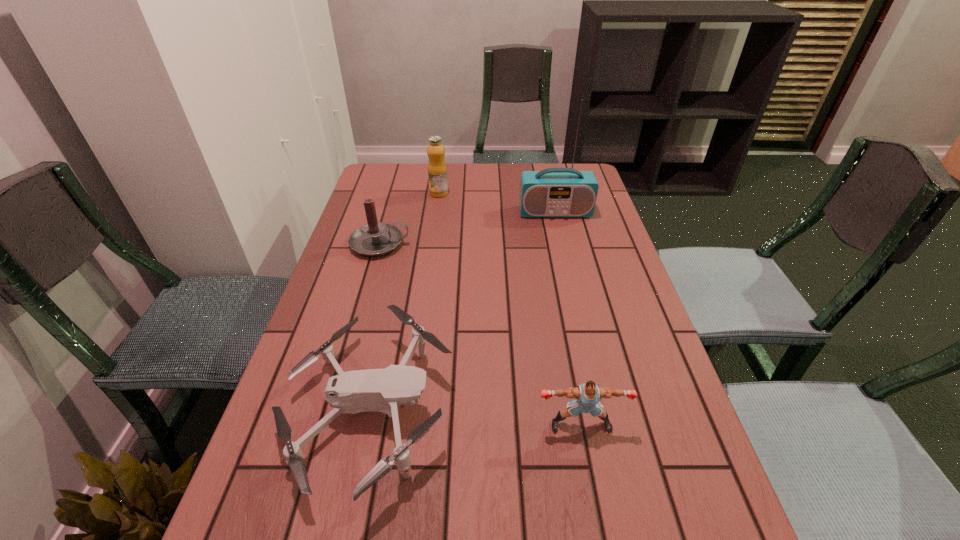
At what (x,y) coordinates should I click in order to perform the action: click on vacant area at the far left corner. Please return your answer as a coordinate pair (x, y). Looking at the image, I should click on (407, 186).

In the image, there is a desktop. Where is `blank space at the far right corner`? This screenshot has height=540, width=960. blank space at the far right corner is located at coordinates (584, 166).

Find the location of a particular element. The image size is (960, 540). free space between the radio receiver and the puncher is located at coordinates (568, 318).

Locate an element on the screen. The image size is (960, 540). free spot between the shortest object and the candle is located at coordinates (374, 328).

Find the location of a particular element. The image size is (960, 540). free spot between the tallest object and the shortest object is located at coordinates (462, 312).

This screenshot has width=960, height=540. In order to click on vacant area between the drone and the third farthest object in this screenshot , I will do click(x=374, y=328).

I want to click on free space between the drone and the fruit juice, so click(x=404, y=303).

Where is `vacant space that's between the second farthest object and the puncher`? This screenshot has height=540, width=960. vacant space that's between the second farthest object and the puncher is located at coordinates (568, 318).

Identify the location of object that is the fourth closest to the puncher. The width and height of the screenshot is (960, 540). (437, 170).

Locate which object ranks third in proximity to the fruit juice. Please provide its 2D coordinates. Your answer should be formatted as a tuple, i.e. [(x, y)], where the tuple contains the x and y coordinates of a point satisfying the conditions above.

[(379, 390)]